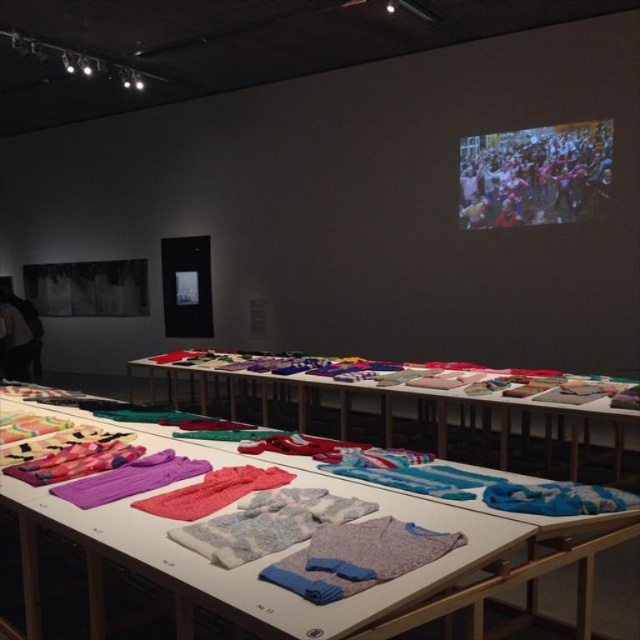
Question: From the image, what is the correct spatial relationship of multicolored fabric at upper right in relation to textured fabric shirts at center?

Choices:
 (A) right
 (B) left

Answer: (A)

Question: Estimate the real-world distances between objects in this image. Which object is closer to the fluffy pink scarf at center?

Choices:
 (A) purple knitwear at left
 (B) multicolored fabric at upper right
 (C) textured fabric shirts at center
 (D) red knit sweater at upper right

Answer: (D)

Question: Which point is closer to the camera?

Choices:
 (A) multicolored fabric at upper right
 (B) textured fabric shirts at center

Answer: (B)

Question: Is multicolored fabric at upper right to the right of purple knitwear at left from the viewer's perspective?

Choices:
 (A) yes
 (B) no

Answer: (A)

Question: Can you confirm if textured fabric shirts at center is positioned above red knit sweater at upper right?

Choices:
 (A) yes
 (B) no

Answer: (B)

Question: Which point is closer to the camera?

Choices:
 (A) textured fabric shirts at center
 (B) fluffy pink scarf at center
 (C) multicolored fabric at upper right

Answer: (A)